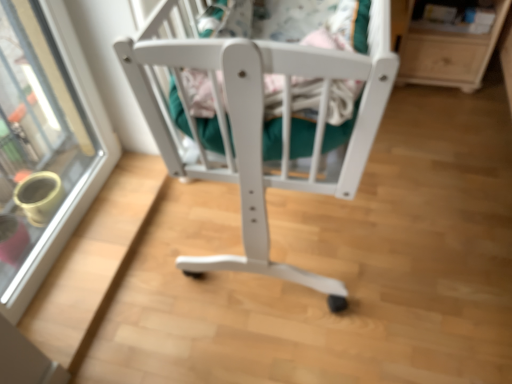
Question: Would you say white wood crib at center contains transparent glass door at upper left?

Choices:
 (A) yes
 (B) no

Answer: (B)

Question: Is white wood crib at center outside of transparent glass door at upper left?

Choices:
 (A) yes
 (B) no

Answer: (A)

Question: Is white wood crib at center not near transparent glass door at upper left?

Choices:
 (A) no
 (B) yes

Answer: (A)

Question: Are white wood crib at center and transparent glass door at upper left beside each other?

Choices:
 (A) no
 (B) yes

Answer: (A)

Question: Is white wood crib at center smaller than transparent glass door at upper left?

Choices:
 (A) yes
 (B) no

Answer: (B)

Question: Is white wood crib at center bigger than transparent glass door at upper left?

Choices:
 (A) yes
 (B) no

Answer: (A)

Question: Is light wood/texture shelf at upper right positioned in front of transparent glass door at upper left?

Choices:
 (A) no
 (B) yes

Answer: (A)

Question: From a real-world perspective, is light wood/texture shelf at upper right positioned under transparent glass door at upper left based on gravity?

Choices:
 (A) yes
 (B) no

Answer: (A)

Question: Is light wood/texture shelf at upper right wider than transparent glass door at upper left?

Choices:
 (A) yes
 (B) no

Answer: (A)

Question: Considering the relative sizes of light wood/texture shelf at upper right and transparent glass door at upper left in the image provided, is light wood/texture shelf at upper right bigger than transparent glass door at upper left?

Choices:
 (A) no
 (B) yes

Answer: (A)

Question: Can you confirm if light wood/texture shelf at upper right is thinner than transparent glass door at upper left?

Choices:
 (A) yes
 (B) no

Answer: (B)

Question: From the image's perspective, is light wood/texture shelf at upper right located beneath transparent glass door at upper left?

Choices:
 (A) yes
 (B) no

Answer: (B)

Question: Can you confirm if transparent glass door at upper left is smaller than light wood/texture shelf at upper right?

Choices:
 (A) no
 (B) yes

Answer: (A)